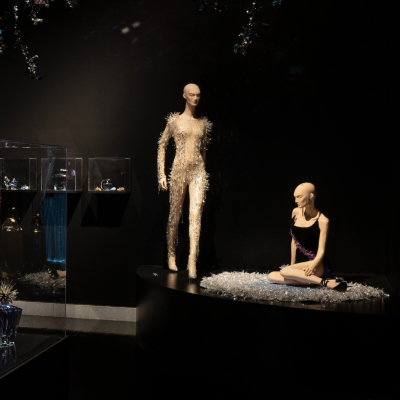
The image size is (400, 400). What are the coordinates of `back wall` in the screenshot? It's located at (345, 157).